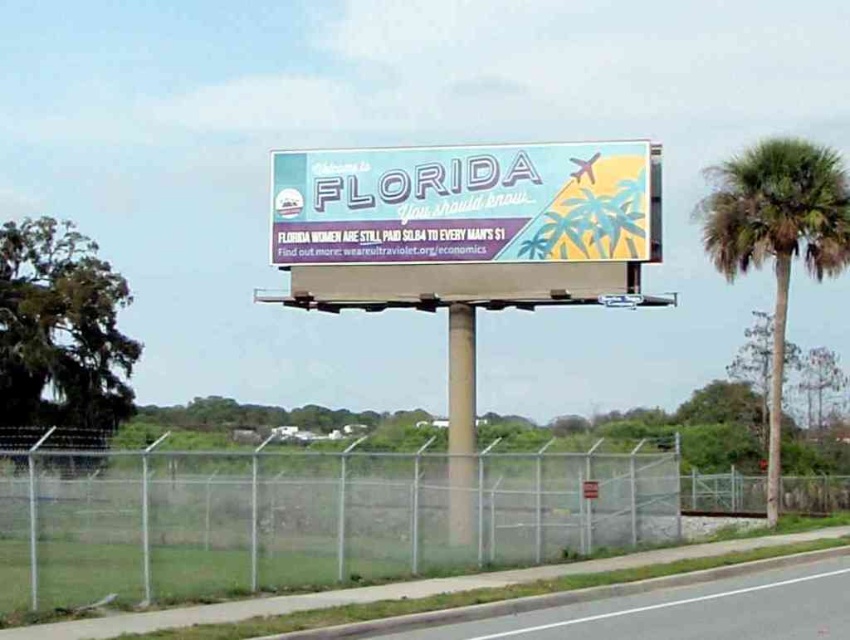
Identify the location of metal chain-link fence at center. The width and height of the screenshot is (850, 640). (306, 518).

Does metal chain-link fence at center appear under asphalt road at lower center?

No, metal chain-link fence at center is not below asphalt road at lower center.

In order to click on metal chain-link fence at center in this screenshot , I will do `click(306, 518)`.

Between pastel paper billboard at center and asphalt road at lower center, which one appears on the right side from the viewer's perspective?

From the viewer's perspective, asphalt road at lower center appears more on the right side.

The height and width of the screenshot is (640, 850). Identify the location of pastel paper billboard at center. pos(466,204).

Between point (446, 157) and point (381, 625), which one is positioned behind?

The point (446, 157) is more distant.

The width and height of the screenshot is (850, 640). In order to click on pastel paper billboard at center in this screenshot , I will do `click(466, 204)`.

Can you confirm if pastel paper billboard at center is positioned to the right of green leafy palm tree at right?

No, pastel paper billboard at center is not to the right of green leafy palm tree at right.

Can you confirm if pastel paper billboard at center is smaller than green leafy palm tree at right?

Correct, pastel paper billboard at center occupies less space than green leafy palm tree at right.

Is point (395, 212) less distant than point (762, 148)?

Yes, it is in front of point (762, 148).

At what (x,y) coordinates should I click in order to perform the action: click on pastel paper billboard at center. Please return your answer as a coordinate pair (x, y). The height and width of the screenshot is (640, 850). Looking at the image, I should click on (466, 204).